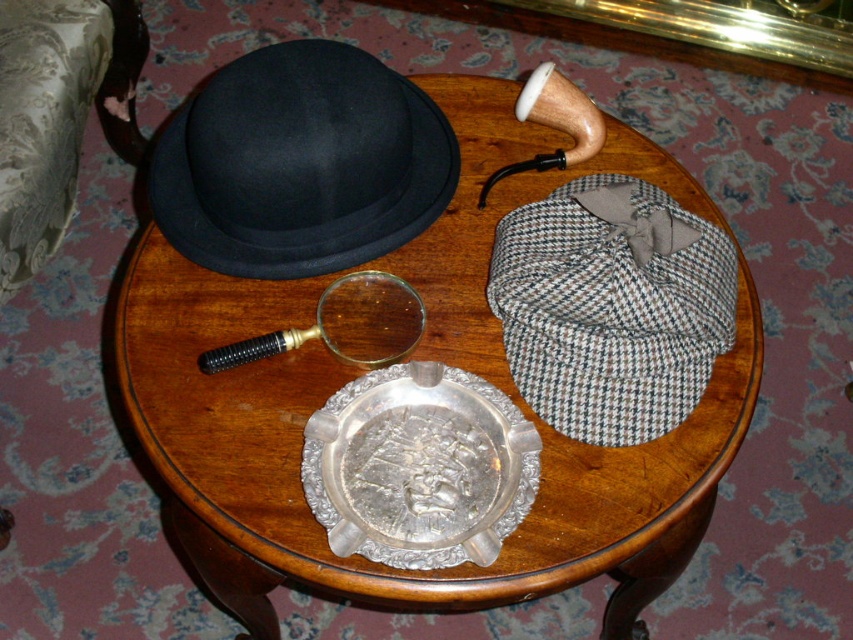
You are a detective examining the items on the round wooden table. You need to place a clue on the silver metallic tray at center. Where should you position the clue relative to the black felt fedora at upper left?

The silver metallic tray at center is to the right of the black felt fedora at upper left, so you should place the clue to the right of the black felt fedora at upper left to position it on the silver metallic tray at center.